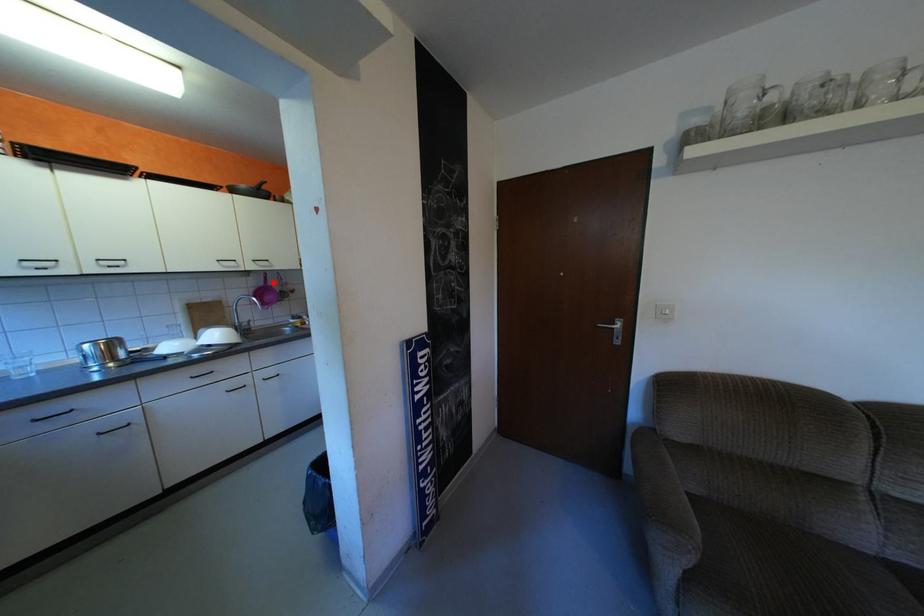
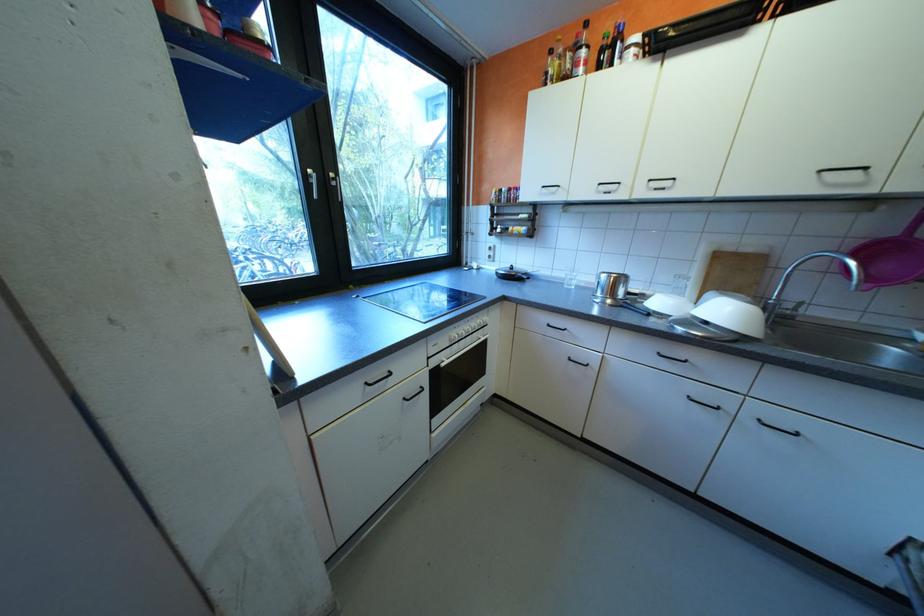
Locate, in the second image, the point that corresponds to the highlighted location in the first image.

(906, 231)